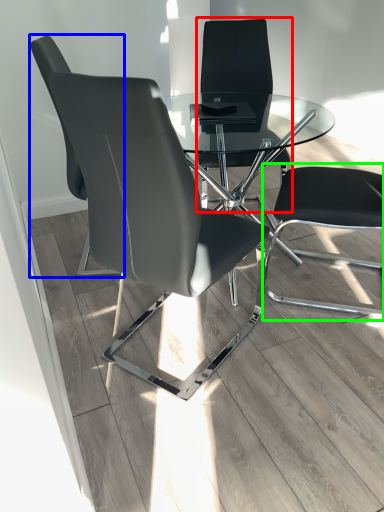
Question: Which object is the farthest from chair (highlighted by a red box)? Choose among these: chair (highlighted by a blue box) or computer chair (highlighted by a green box).

Choices:
 (A) chair
 (B) computer chair

Answer: (A)